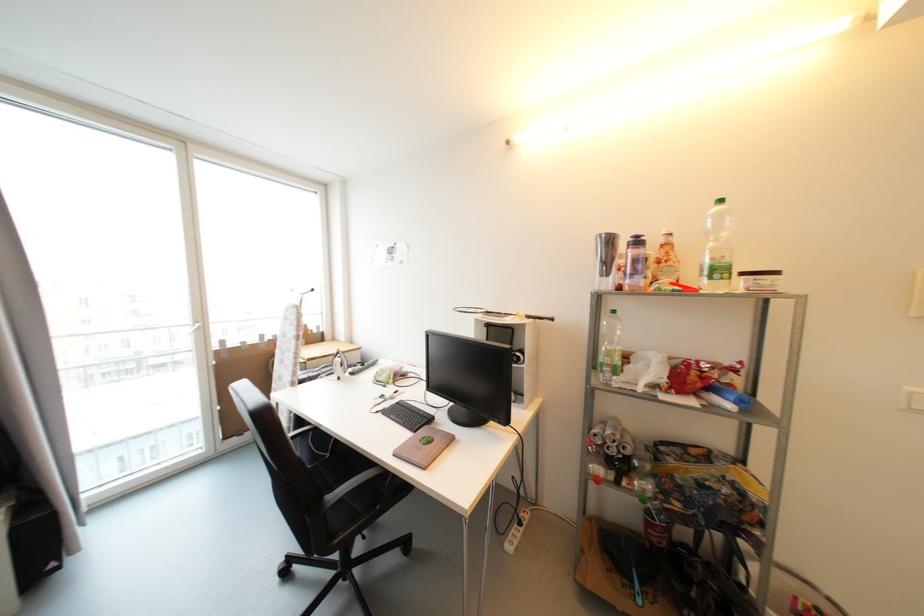
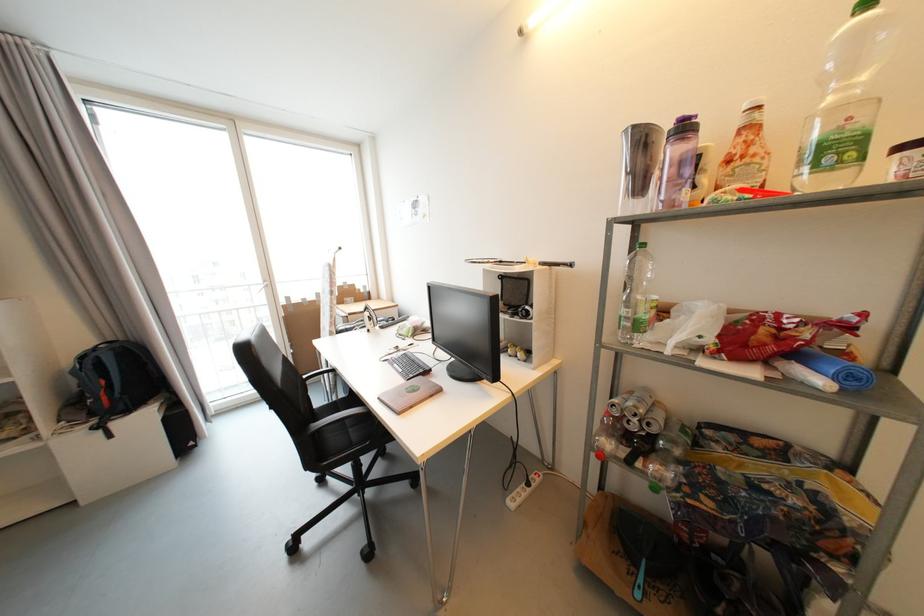
Find the pixel in the second image that matches point 421,428 in the first image.

(417, 378)